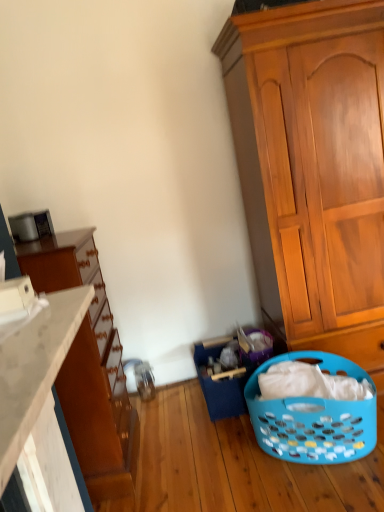
Question: Considering the relative positions of matte brown dresser at left and blue plastic laundry basket at lower center in the image provided, is matte brown dresser at left in front of blue plastic laundry basket at lower center?

Choices:
 (A) no
 (B) yes

Answer: (B)

Question: Is matte brown dresser at left taller than blue plastic laundry basket at lower center?

Choices:
 (A) no
 (B) yes

Answer: (B)

Question: Are matte brown dresser at left and blue plastic laundry basket at lower center far apart?

Choices:
 (A) no
 (B) yes

Answer: (A)

Question: Is matte brown dresser at left directly adjacent to blue plastic laundry basket at lower center?

Choices:
 (A) no
 (B) yes

Answer: (A)

Question: From the image's perspective, is matte brown dresser at left over blue plastic laundry basket at lower center?

Choices:
 (A) no
 (B) yes

Answer: (B)

Question: Does matte brown dresser at left have a smaller size compared to blue plastic laundry basket at lower center?

Choices:
 (A) yes
 (B) no

Answer: (B)

Question: Does white matte countertop at lower left touch blue plastic laundry basket at lower center?

Choices:
 (A) no
 (B) yes

Answer: (A)

Question: Does white matte countertop at lower left have a greater height compared to blue plastic laundry basket at lower center?

Choices:
 (A) no
 (B) yes

Answer: (A)

Question: Is white matte countertop at lower left positioned before blue plastic laundry basket at lower center?

Choices:
 (A) yes
 (B) no

Answer: (A)

Question: Is white matte countertop at lower left shorter than blue plastic laundry basket at lower center?

Choices:
 (A) no
 (B) yes

Answer: (B)

Question: From a real-world perspective, is white matte countertop at lower left over blue plastic laundry basket at lower center?

Choices:
 (A) no
 (B) yes

Answer: (B)

Question: Can you confirm if white matte countertop at lower left is smaller than blue plastic laundry basket at lower center?

Choices:
 (A) yes
 (B) no

Answer: (A)

Question: From a real-world perspective, is wooden cabinet at right located beneath white matte countertop at lower left?

Choices:
 (A) no
 (B) yes

Answer: (B)